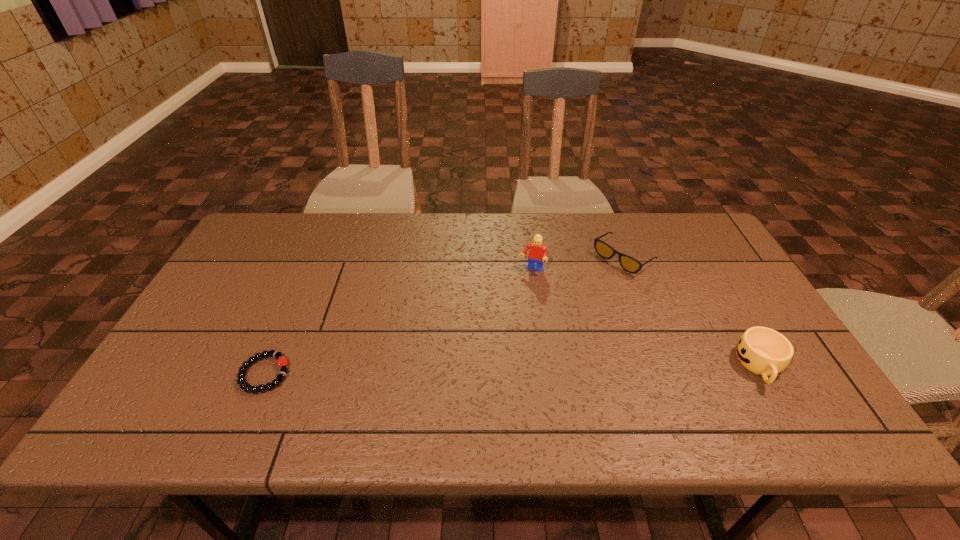
The image size is (960, 540). Find the location of `bracelet`. bracelet is located at coordinates [x=282, y=361].

In order to click on the shortest object in this screenshot , I will do `click(282, 361)`.

The image size is (960, 540). Identify the location of the rightmost object. (763, 351).

The width and height of the screenshot is (960, 540). Identify the location of the third object from right to left. (537, 254).

Locate an element on the screen. the tallest object is located at coordinates (537, 254).

This screenshot has width=960, height=540. In order to click on the second object from right to left in this screenshot , I will do `click(628, 263)`.

Locate an element on the screen. The width and height of the screenshot is (960, 540). the second shortest object is located at coordinates (628, 263).

Locate an element on the screen. This screenshot has height=540, width=960. vacant space located 0.320m on the right of the bracelet is located at coordinates (425, 374).

Image resolution: width=960 pixels, height=540 pixels. In order to click on free space located on the back of the cup in this screenshot , I will do `click(703, 265)`.

The height and width of the screenshot is (540, 960). I want to click on free point located on the front-facing side of the second object from left to right, so click(516, 308).